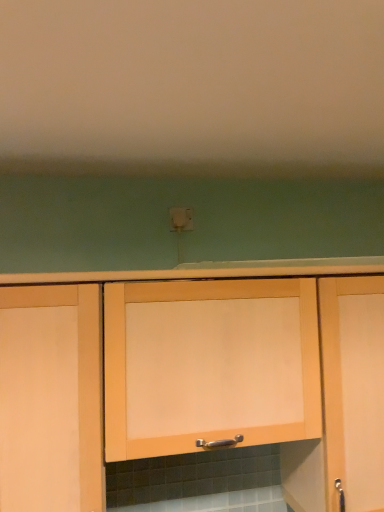
Question: Which direction should I rotate to face light wood cabinet at center, acting as the third cabinetry starting from the left, — up or down?

Choices:
 (A) up
 (B) down

Answer: (B)

Question: Considering the relative sizes of light wood cabinet at center, acting as the third cabinetry starting from the left, and white plastic electric outlet at center in the image provided, is light wood cabinet at center, acting as the third cabinetry starting from the left, bigger than white plastic electric outlet at center?

Choices:
 (A) yes
 (B) no

Answer: (A)

Question: Does light wood cabinet at center, acting as the third cabinetry starting from the left, appear on the left side of white plastic electric outlet at center?

Choices:
 (A) yes
 (B) no

Answer: (B)

Question: Does light wood cabinet at center, the 1th cabinetry when ordered from right to left, have a greater width compared to white plastic electric outlet at center?

Choices:
 (A) yes
 (B) no

Answer: (A)

Question: From the image's perspective, is light wood cabinet at center, the 1th cabinetry when ordered from right to left, on white plastic electric outlet at center?

Choices:
 (A) no
 (B) yes

Answer: (A)

Question: Is light wood cabinet at center, acting as the third cabinetry starting from the left, oriented away from white plastic electric outlet at center?

Choices:
 (A) no
 (B) yes

Answer: (A)

Question: Is light wood cabinet at center, acting as the third cabinetry starting from the left, positioned before white plastic electric outlet at center?

Choices:
 (A) yes
 (B) no

Answer: (A)

Question: Considering the relative positions of matte wood cabinet at left, the first cabinetry when ordered from left to right, and white plastic electric outlet at center in the image provided, is matte wood cabinet at left, the first cabinetry when ordered from left to right, to the right of white plastic electric outlet at center from the viewer's perspective?

Choices:
 (A) no
 (B) yes

Answer: (A)

Question: Is matte wood cabinet at left, the first cabinetry when ordered from left to right, to the left of white plastic electric outlet at center from the viewer's perspective?

Choices:
 (A) no
 (B) yes

Answer: (B)

Question: From the image's perspective, is matte wood cabinet at left, the first cabinetry when ordered from left to right, below white plastic electric outlet at center?

Choices:
 (A) yes
 (B) no

Answer: (A)

Question: Is matte wood cabinet at left, the 3th cabinetry in the right-to-left sequence, shorter than white plastic electric outlet at center?

Choices:
 (A) yes
 (B) no

Answer: (B)

Question: Can you confirm if matte wood cabinet at left, the first cabinetry when ordered from left to right, is taller than white plastic electric outlet at center?

Choices:
 (A) yes
 (B) no

Answer: (A)

Question: Considering the relative sizes of matte wood cabinet at left, the 3th cabinetry in the right-to-left sequence, and white plastic electric outlet at center in the image provided, is matte wood cabinet at left, the 3th cabinetry in the right-to-left sequence, thinner than white plastic electric outlet at center?

Choices:
 (A) no
 (B) yes

Answer: (A)

Question: From the image's perspective, is light wood cabinet at center, acting as the third cabinetry starting from the left, over light wood cabinet at center, acting as the 2th cabinetry starting from the right?

Choices:
 (A) yes
 (B) no

Answer: (B)